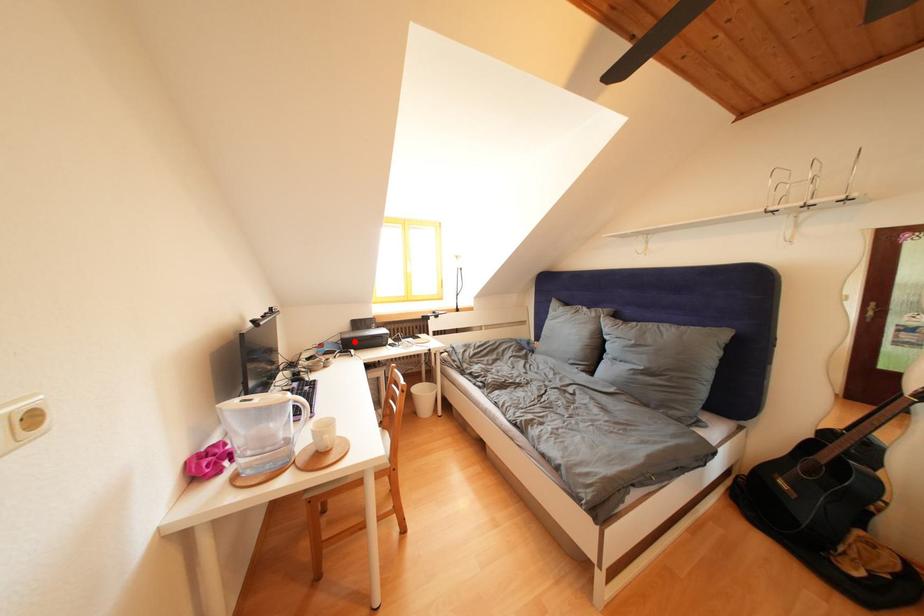
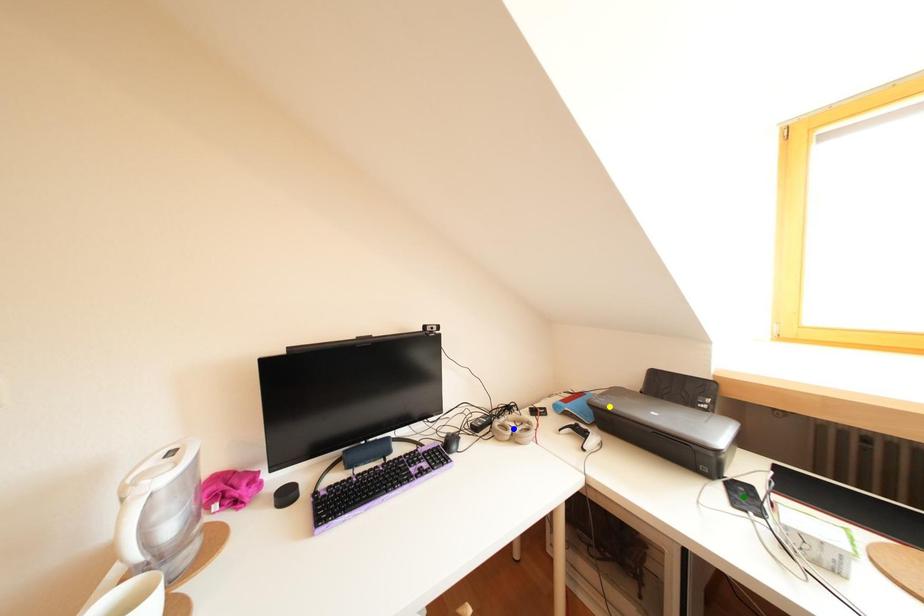
Question: I am providing you with two images of the same scene from different viewpoints. A red point is marked on the first image. You are given multiple points on the second image. Which point in image 2 is actually the same real-world point as the red point in image 1?

Choices:
 (A) blue point
 (B) green point
 (C) yellow point

Answer: (C)